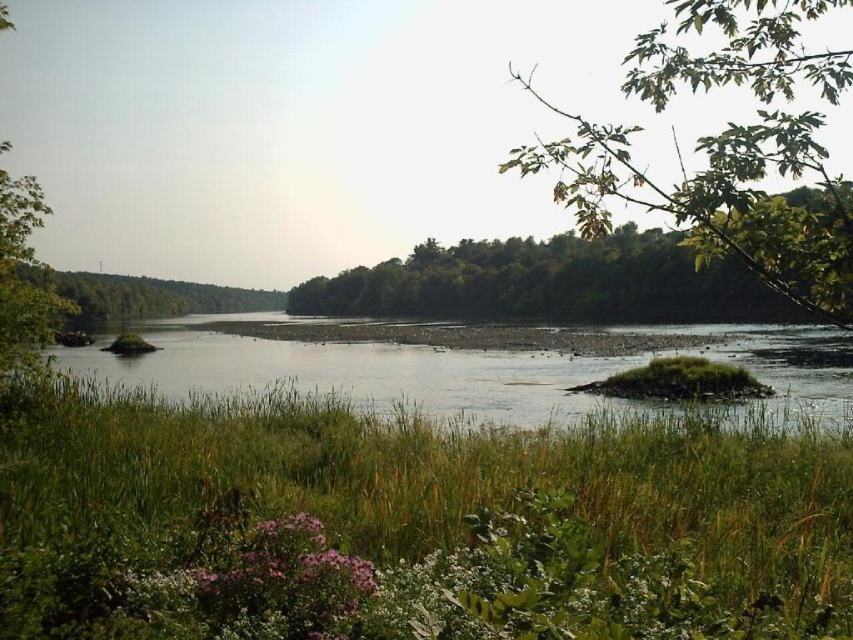
Between green grassy patch at lower center and green leafy branch at upper right, which one has more height?

green leafy branch at upper right

Is green grassy patch at lower center thinner than green leafy branch at upper right?

Indeed, green grassy patch at lower center has a lesser width compared to green leafy branch at upper right.

Find the location of `green grassy patch at lower center`. green grassy patch at lower center is located at coordinates (409, 525).

Can you confirm if green grassy river at center is taller than green leafy tree at center?

No, green grassy river at center is not taller than green leafy tree at center.

Is point (469, 362) positioned behind point (517, 280)?

No, (469, 362) is in front of (517, 280).

Locate an element on the screen. green grassy river at center is located at coordinates (467, 369).

Between point (86, 612) and point (120, 360), which one is positioned in front?

Point (86, 612) is more forward.

How much distance is there between green grassy patch at lower center and green grassy river at center?

green grassy patch at lower center is 17.42 meters from green grassy river at center.

This screenshot has height=640, width=853. Identify the location of green grassy patch at lower center. (409, 525).